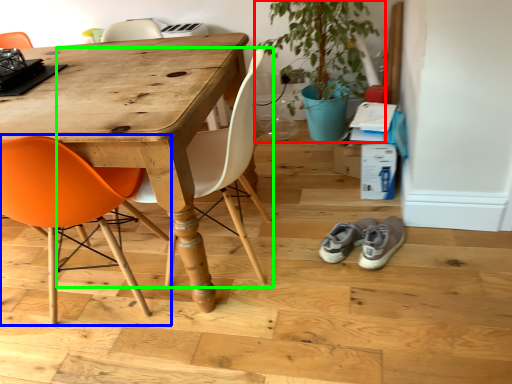
Question: Which is nearer to the houseplant (highlighted by a red box)? chair (highlighted by a blue box) or chair (highlighted by a green box).

Choices:
 (A) chair
 (B) chair

Answer: (B)